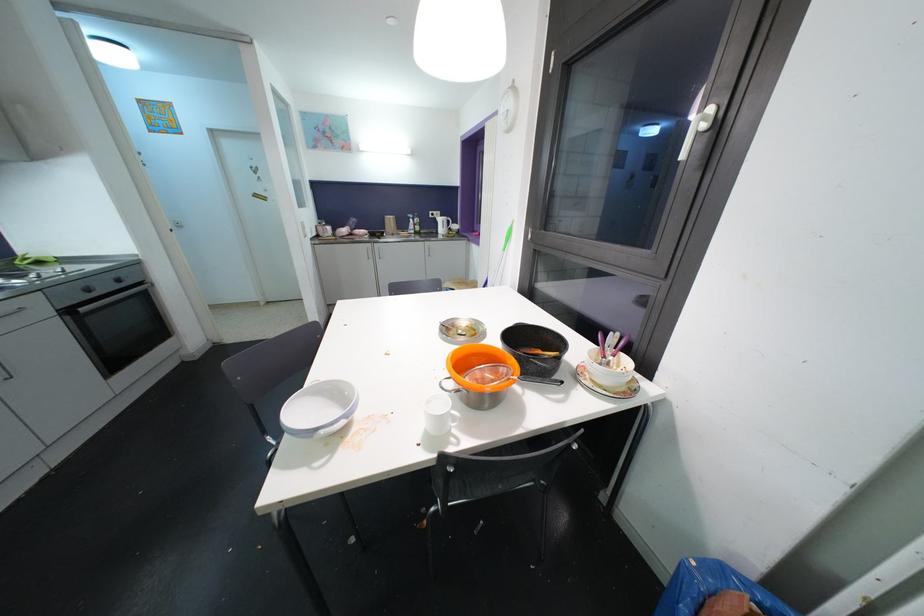
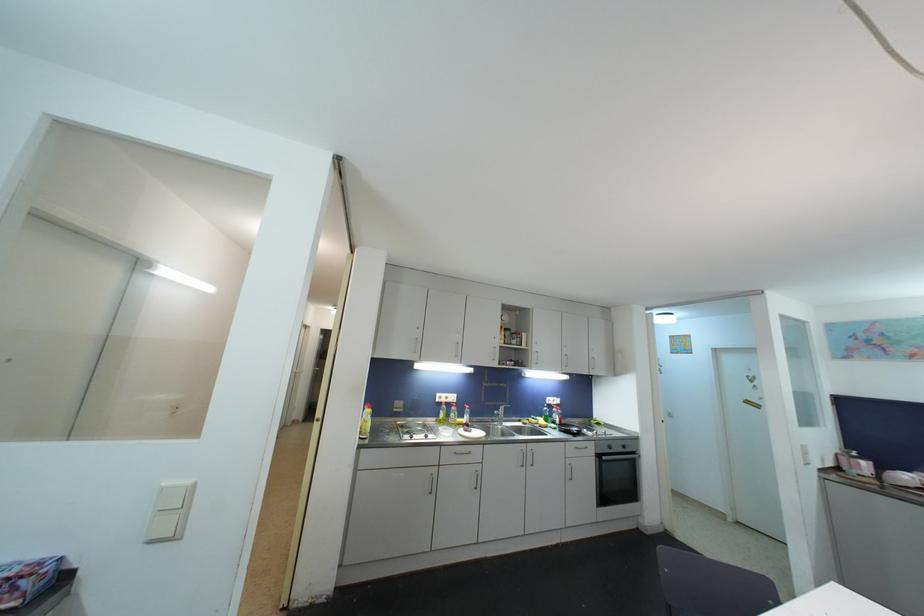
In the second image, find the point that corresponds to pixel 83 286 in the first image.

(611, 446)